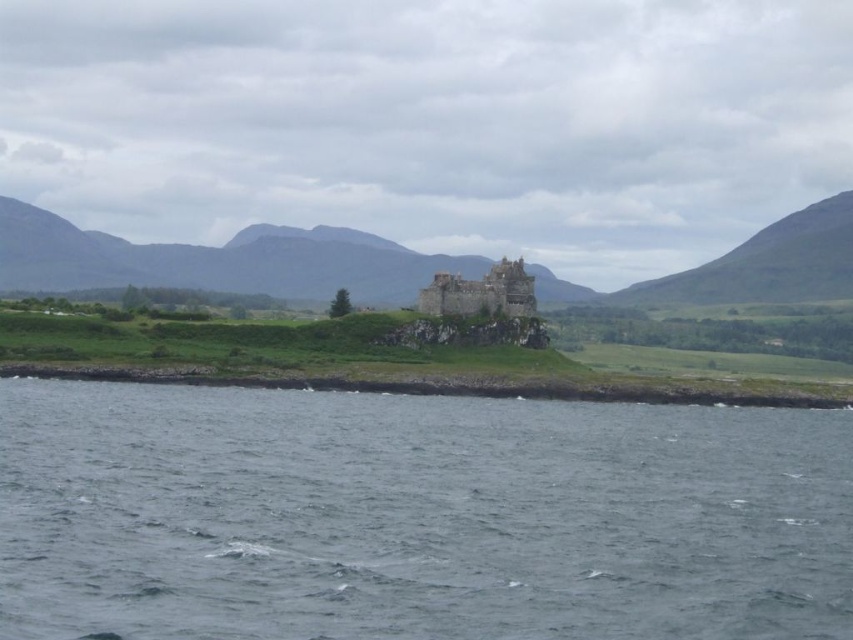
Between green grassy hill at right and rustic stone castle at center, which one appears on the right side from the viewer's perspective?

Positioned to the right is green grassy hill at right.

Does green grassy hill at right lie in front of rustic stone castle at center?

No.

Find the location of a particular element. Image resolution: width=853 pixels, height=640 pixels. green grassy hill at right is located at coordinates (767, 262).

Can you confirm if gray water at lower center is positioned to the left of green grassy shoreline at lower center?

Yes, gray water at lower center is to the left of green grassy shoreline at lower center.

You are a GUI agent. You are given a task and a screenshot of the screen. Output one action in this format:
    pyautogui.click(x=<x>, y=<y>)
    Task: Click on the gray water at lower center
    
    Given the screenshot: What is the action you would take?
    pyautogui.click(x=415, y=516)

Is point (276, 451) positioned behind point (183, 369)?

That is False.

You are a GUI agent. You are given a task and a screenshot of the screen. Output one action in this format:
    pyautogui.click(x=<x>, y=<y>)
    Task: Click on the gray water at lower center
    
    Given the screenshot: What is the action you would take?
    pyautogui.click(x=415, y=516)

Between point (608, 481) and point (27, 280), which one is positioned behind?

Positioned behind is point (27, 280).

Can you confirm if gray water at lower center is positioned above green grassy hill at center?

Actually, gray water at lower center is below green grassy hill at center.

Between point (850, 628) and point (264, 244), which one is positioned behind?

Point (264, 244)

Locate an element on the screen. gray water at lower center is located at coordinates (415, 516).